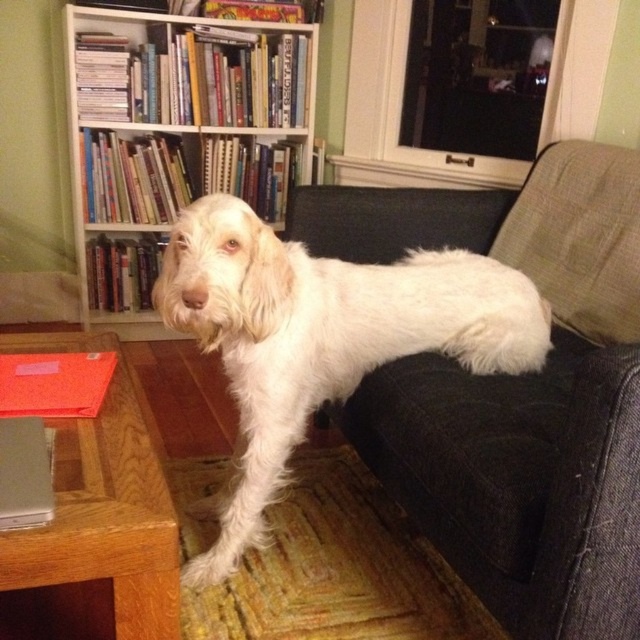
Question: Is white fabric armchair at right below wooden table at lower left?

Choices:
 (A) no
 (B) yes

Answer: (A)

Question: Which point appears farthest from the camera in this image?

Choices:
 (A) (257, 26)
 (B) (410, 512)
 (C) (490, 337)

Answer: (A)

Question: Does white wood bookcase at upper center come behind wooden table at lower left?

Choices:
 (A) no
 (B) yes

Answer: (B)

Question: Based on their relative distances, which object is farther from the wooden table at lower left?

Choices:
 (A) white wood bookcase at upper center
 (B) white fluffy dog at center
 (C) white fabric armchair at right

Answer: (A)

Question: Is white fluffy dog at center wider than wooden table at lower left?

Choices:
 (A) no
 (B) yes

Answer: (B)

Question: Which point is closer to the camera taking this photo?

Choices:
 (A) [x=380, y=340]
 (B) [x=86, y=36]

Answer: (A)